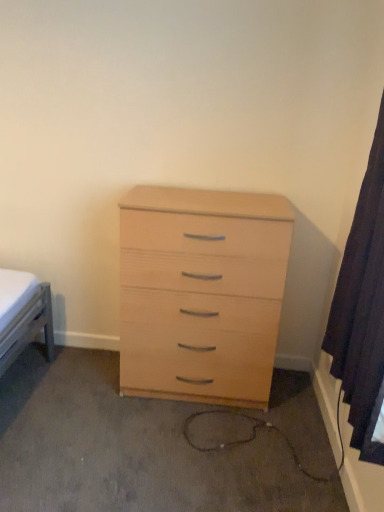
Locate an element on the screen. This screenshot has width=384, height=512. vacant space in front of light wood chest of drawers at center is located at coordinates (188, 449).